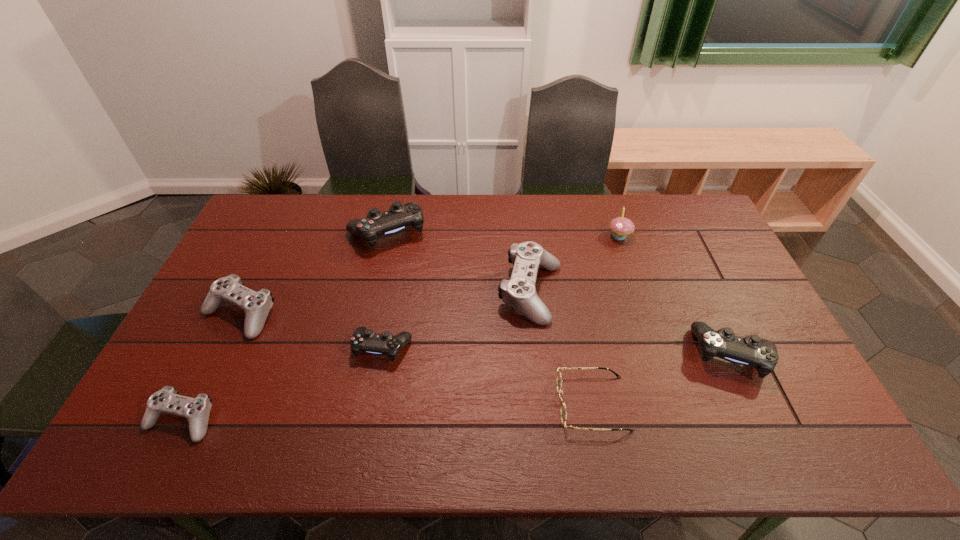
Identify the location of the closest black control to the second biggest black control. This screenshot has width=960, height=540. (366, 340).

Locate which white control ranks second in proximity to the rightmost white control. Please provide its 2D coordinates. Your answer should be formatted as a tuple, i.e. [(x, y)], where the tuple contains the x and y coordinates of a point satisfying the conditions above.

[(197, 410)]

Locate which white control ranks third in proximity to the farthest control. Please provide its 2D coordinates. Your answer should be formatted as a tuple, i.e. [(x, y)], where the tuple contains the x and y coordinates of a point satisfying the conditions above.

[(197, 410)]

At what (x,y) coordinates should I click in order to perform the action: click on free location that satisfies the following two spatial constraints: 1. on the back side of the second smallest white control; 2. on the right side of the cupcake. Please return your answer as a coordinate pair (x, y). The width and height of the screenshot is (960, 540). Looking at the image, I should click on (277, 237).

I want to click on vacant position in the image that satisfies the following two spatial constraints: 1. on the back side of the pink cupcake; 2. on the left side of the second smallest white control, so click(277, 237).

This screenshot has height=540, width=960. I want to click on free space that satisfies the following two spatial constraints: 1. on the front side of the rightmost control; 2. on the right side of the second object from right to left, so click(x=659, y=354).

Identify the location of free space that satisfies the following two spatial constraints: 1. on the back side of the biggest white control; 2. on the right side of the smallest black control. The height and width of the screenshot is (540, 960). (393, 292).